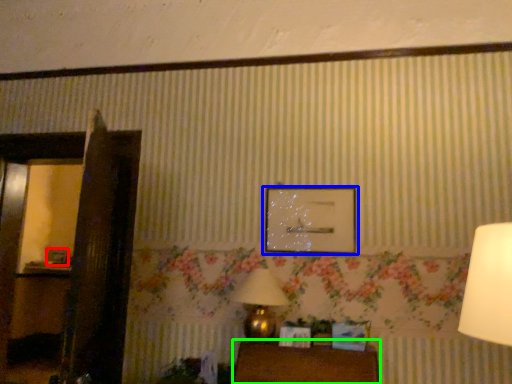
Question: Which object is positioned closest to picture frame (highlighted by a red box)? Select from picture frame (highlighted by a blue box) and furniture (highlighted by a green box).

Choices:
 (A) picture frame
 (B) furniture

Answer: (A)